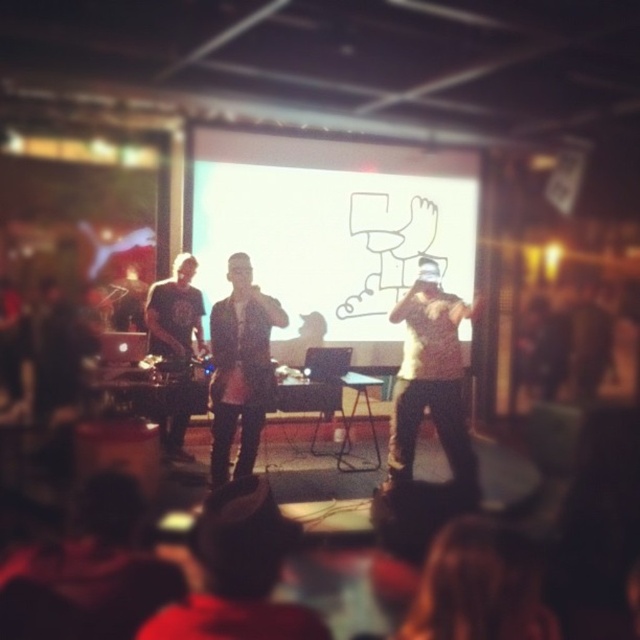
Question: Which object is farther from the camera taking this photo?

Choices:
 (A) white knit hat at center
 (B) dark gray fabric shirt at left
 (C) white matte projection screen at center

Answer: (C)

Question: Is dark gray leather jacket at center to the left of dark gray fabric shirt at left from the viewer's perspective?

Choices:
 (A) no
 (B) yes

Answer: (A)

Question: Which point appears farthest from the camera in this image?

Choices:
 (A) (330, 339)
 (B) (396, 436)
 (C) (147, 304)

Answer: (A)

Question: Which object appears closest to the camera in this image?

Choices:
 (A) dark gray fabric shirt at left
 (B) white knit hat at center

Answer: (B)

Question: Is white matte projection screen at center positioned in front of dark gray fabric shirt at left?

Choices:
 (A) no
 (B) yes

Answer: (A)

Question: Can you confirm if white matte projection screen at center is positioned above white knit hat at center?

Choices:
 (A) no
 (B) yes

Answer: (B)